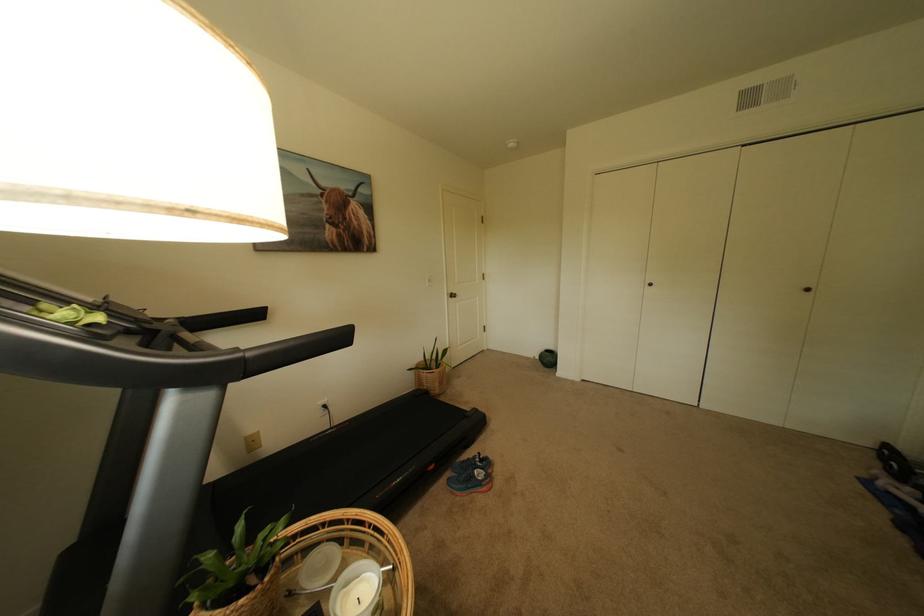
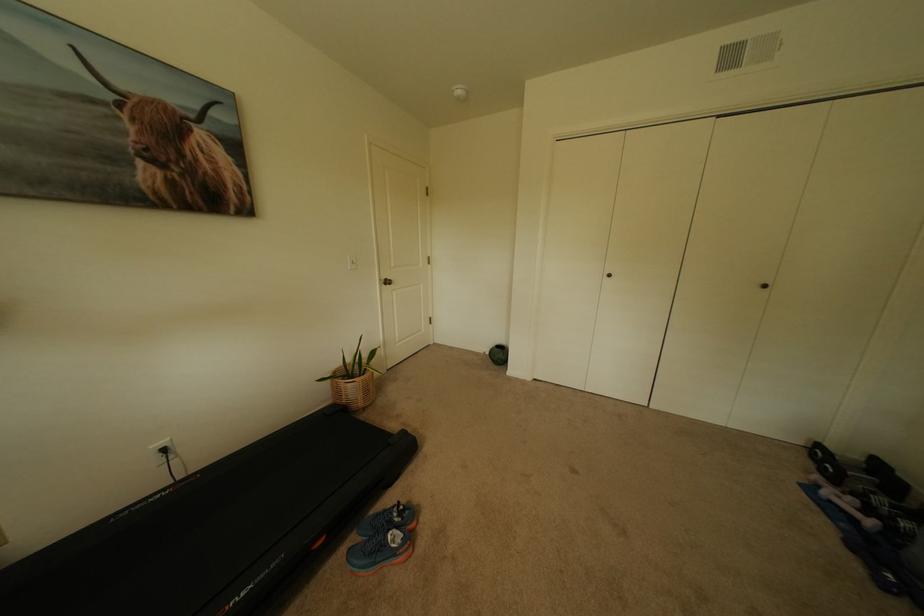
In the second image, find the point that corresponds to point (333, 408) in the first image.

(173, 451)